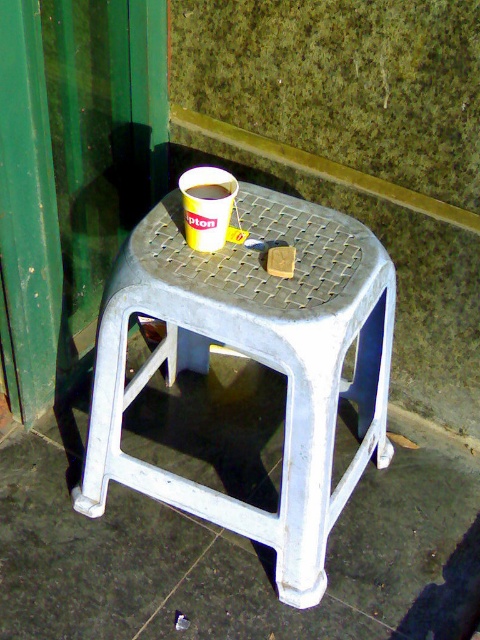
Question: Which point is farther to the camera?

Choices:
 (A) coord(215,228)
 (B) coord(205,196)

Answer: (B)

Question: Can you confirm if yellow paper cup at center is positioned above matte yellow cup at center?

Choices:
 (A) yes
 (B) no

Answer: (B)

Question: Is yellow paper cup at center bigger than matte yellow cup at center?

Choices:
 (A) no
 (B) yes

Answer: (B)

Question: Which object is closer to the camera taking this photo?

Choices:
 (A) matte yellow cup at center
 (B) white plastic stool at center

Answer: (B)

Question: Which object appears closest to the camera in this image?

Choices:
 (A) white plastic stool at center
 (B) yellow paper cup at center

Answer: (A)

Question: Is white plastic stool at center below yellow paper cup at center?

Choices:
 (A) yes
 (B) no

Answer: (A)